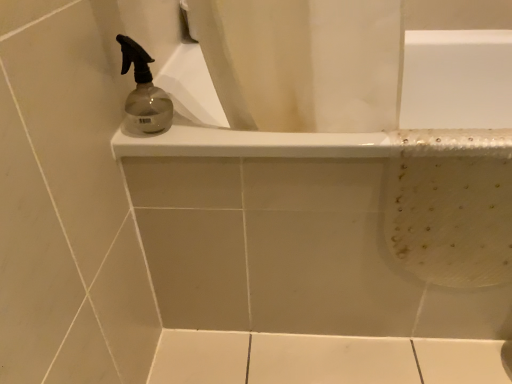
Question: Is white glossy bathtub at upper center outside transparent glass spray bottle at upper left?

Choices:
 (A) no
 (B) yes

Answer: (B)

Question: Considering the relative sizes of white glossy bathtub at upper center and transparent glass spray bottle at upper left in the image provided, is white glossy bathtub at upper center shorter than transparent glass spray bottle at upper left?

Choices:
 (A) no
 (B) yes

Answer: (A)

Question: Is white glossy bathtub at upper center positioned behind transparent glass spray bottle at upper left?

Choices:
 (A) yes
 (B) no

Answer: (A)

Question: Is white glossy bathtub at upper center to the left of transparent glass spray bottle at upper left from the viewer's perspective?

Choices:
 (A) yes
 (B) no

Answer: (B)

Question: Considering the relative sizes of white glossy bathtub at upper center and transparent glass spray bottle at upper left in the image provided, is white glossy bathtub at upper center bigger than transparent glass spray bottle at upper left?

Choices:
 (A) no
 (B) yes

Answer: (B)

Question: Does white glossy bathtub at upper center come in front of transparent glass spray bottle at upper left?

Choices:
 (A) no
 (B) yes

Answer: (A)

Question: Is transparent glass spray bottle at upper left bigger than white glossy bathtub at upper center?

Choices:
 (A) no
 (B) yes

Answer: (A)

Question: Can you confirm if transparent glass spray bottle at upper left is wider than white glossy bathtub at upper center?

Choices:
 (A) no
 (B) yes

Answer: (A)

Question: From a real-world perspective, is transparent glass spray bottle at upper left positioned over white glossy bathtub at upper center based on gravity?

Choices:
 (A) no
 (B) yes

Answer: (B)

Question: Is transparent glass spray bottle at upper left closer to the viewer compared to white glossy bathtub at upper center?

Choices:
 (A) yes
 (B) no

Answer: (A)

Question: Is transparent glass spray bottle at upper left shorter than white glossy bathtub at upper center?

Choices:
 (A) no
 (B) yes

Answer: (B)

Question: Is transparent glass spray bottle at upper left facing towards white glossy bathtub at upper center?

Choices:
 (A) no
 (B) yes

Answer: (A)

Question: Considering the positions of transparent glass spray bottle at upper left and white glossy bathtub at upper center in the image, is transparent glass spray bottle at upper left taller or shorter than white glossy bathtub at upper center?

Choices:
 (A) tall
 (B) short

Answer: (B)